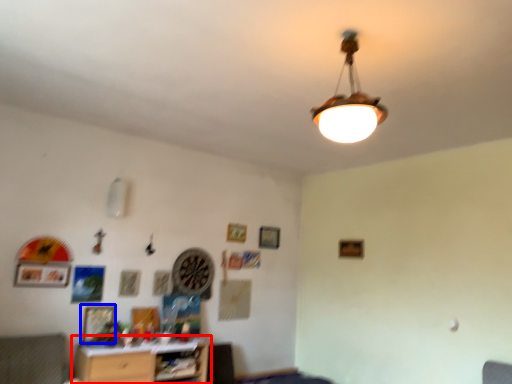
Question: Among these objects, which one is farthest to the camera, table (highlighted by a red box) or picture frame (highlighted by a blue box)?

Choices:
 (A) table
 (B) picture frame

Answer: (B)